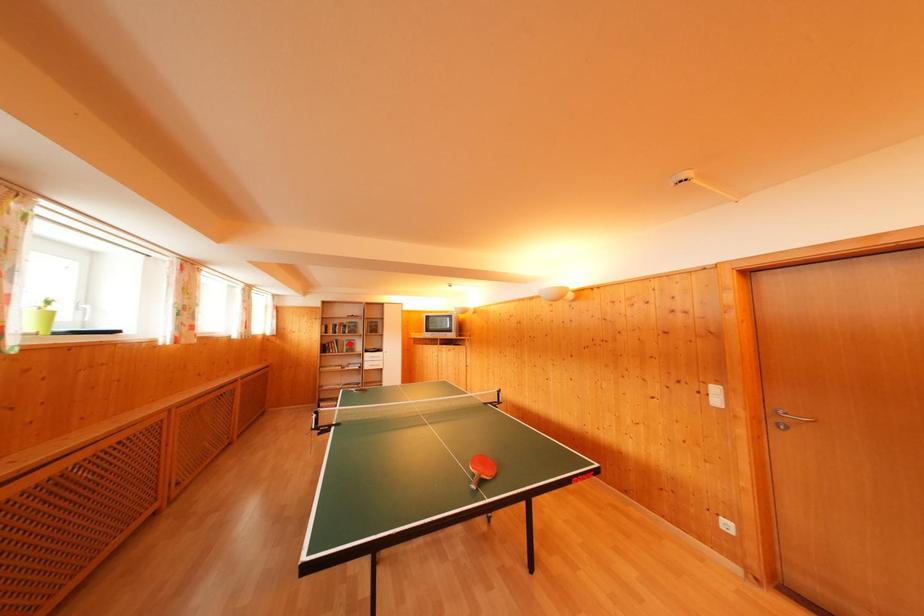
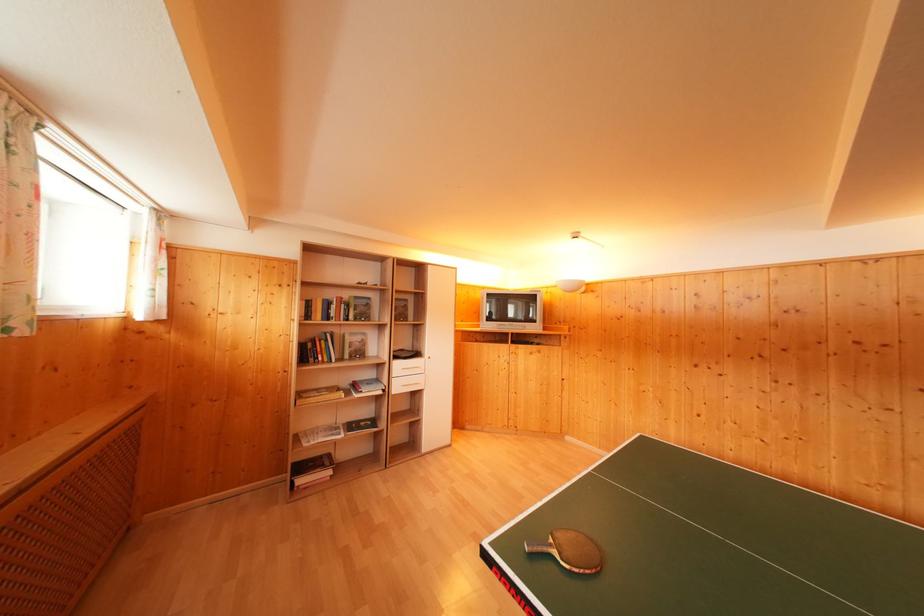
Question: A red point is marked in image1. In image2, is the corresponding 3D point closer to the camera or farther? Reply with the corresponding letter.

Choices:
 (A) The corresponding 3D point is closer.
 (B) The corresponding 3D point is farther.

Answer: (A)